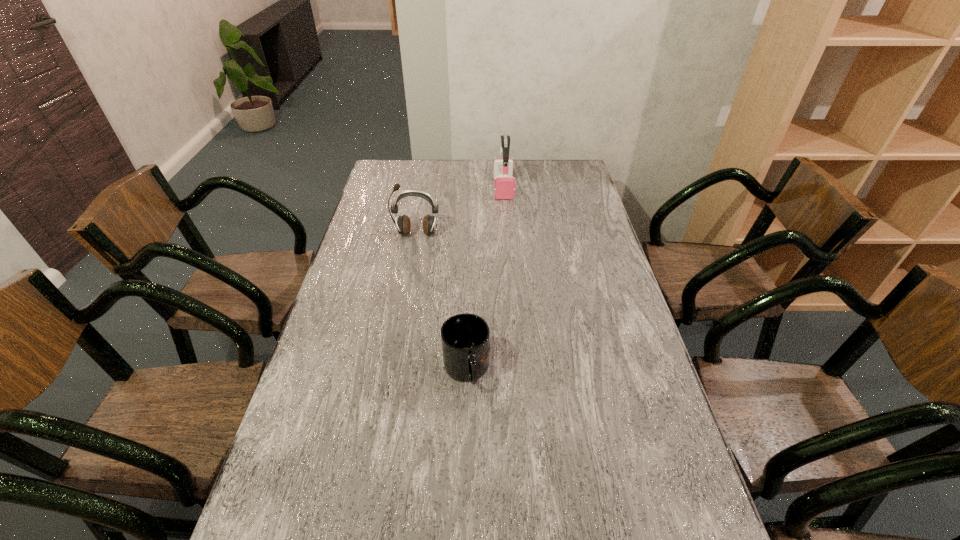
You are a GUI agent. You are given a task and a screenshot of the screen. Output one action in this format:
    pyautogui.click(x=<x>, y=<y>)
    Task: Click on the object that is at the left edge
    
    Given the screenshot: What is the action you would take?
    pyautogui.click(x=403, y=223)

Find the location of `free space at the far edge of the desktop`. free space at the far edge of the desktop is located at coordinates pyautogui.click(x=516, y=169).

Where is `vacant space at the left edge of the desktop`? The image size is (960, 540). vacant space at the left edge of the desktop is located at coordinates (257, 532).

This screenshot has width=960, height=540. I want to click on vacant region at the right edge, so click(x=583, y=207).

The height and width of the screenshot is (540, 960). Find the location of `unoccupied position between the nearest object and the farther earphone`. unoccupied position between the nearest object and the farther earphone is located at coordinates (485, 279).

At what (x,y) coordinates should I click in order to perform the action: click on free spot between the mug and the left earphone. Please return your answer as a coordinate pair (x, y). Looking at the image, I should click on (442, 302).

Identify the location of free space that is in between the leftmost object and the farthest object. This screenshot has width=960, height=540. (460, 211).

Locate an element on the screen. The image size is (960, 540). free space between the nearest object and the leftmost object is located at coordinates (442, 302).

Where is `vacant area that lies between the farther earphone and the nearer earphone`? The width and height of the screenshot is (960, 540). vacant area that lies between the farther earphone and the nearer earphone is located at coordinates (460, 211).

The width and height of the screenshot is (960, 540). Find the location of `vacant space that is in between the second object from left to right and the second farthest object`. vacant space that is in between the second object from left to right and the second farthest object is located at coordinates (442, 302).